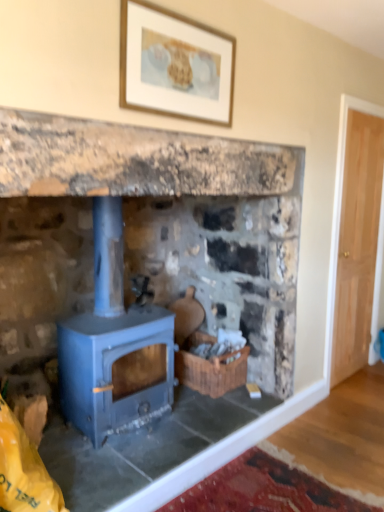
At what (x,y) coordinates should I click in order to perform the action: click on vacant space to the right of blue matte wood burning stove at center. Please return your answer as a coordinate pair (x, y). The image size is (384, 512). Looking at the image, I should click on (201, 415).